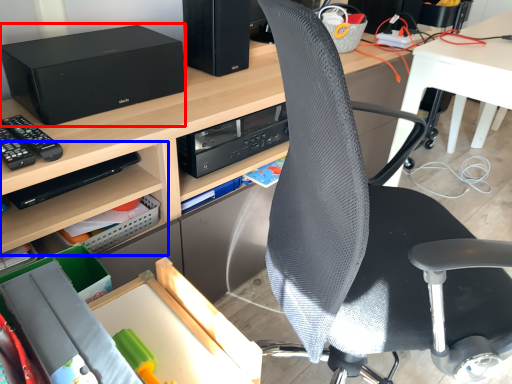
Question: Among these objects, which one is nearest to the camera, stereo (highlighted by a red box) or shelf (highlighted by a blue box)?

Choices:
 (A) stereo
 (B) shelf

Answer: (A)